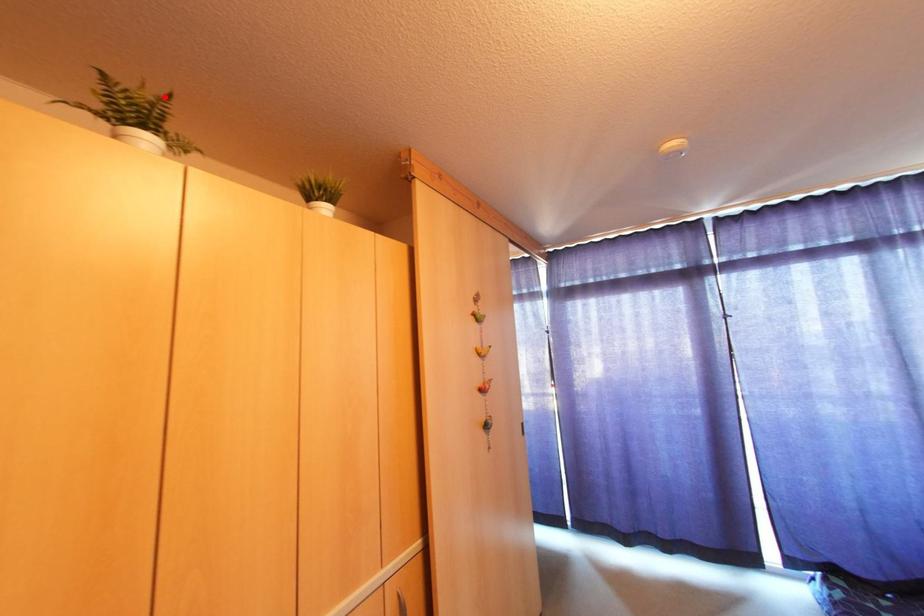
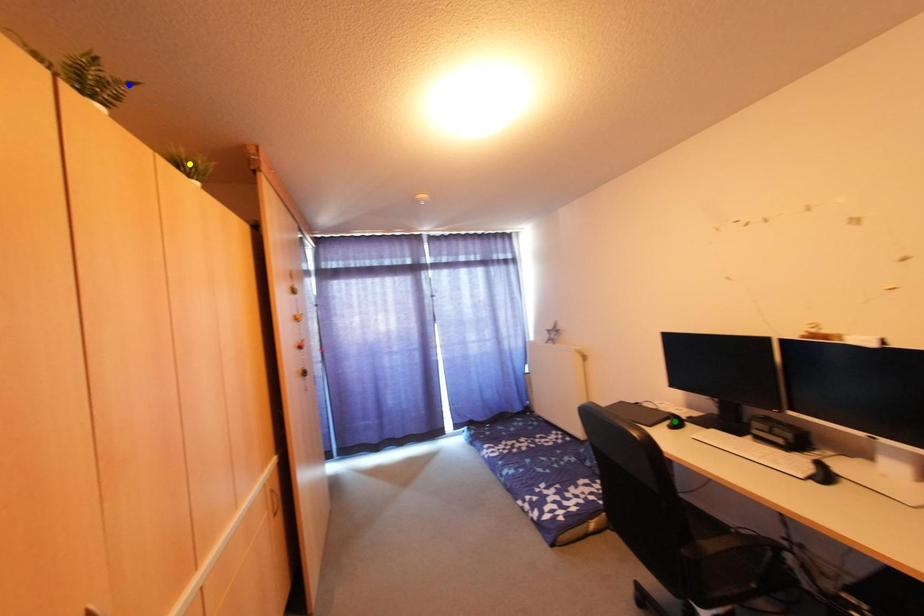
Question: I am providing you with two images of the same scene from different viewpoints. A red point is marked on the first image. You are given multiple points on the second image. Which mark in image 2 goes with the point in image 1?

Choices:
 (A) yellow point
 (B) blue point
 (C) green point

Answer: (B)